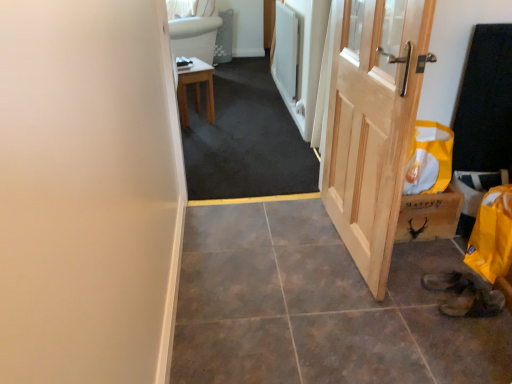
Locate an element on the screen. This screenshot has width=512, height=384. vacant region to the left of brown leather shoe at lower right is located at coordinates (419, 307).